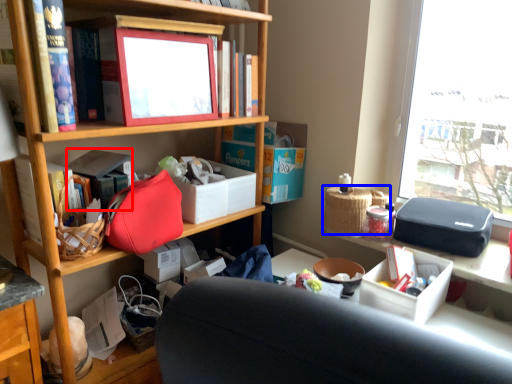
Question: Which object appears closest to the camera in this image, book (highlighted by a red box) or picnic basket (highlighted by a blue box)?

Choices:
 (A) book
 (B) picnic basket

Answer: (A)